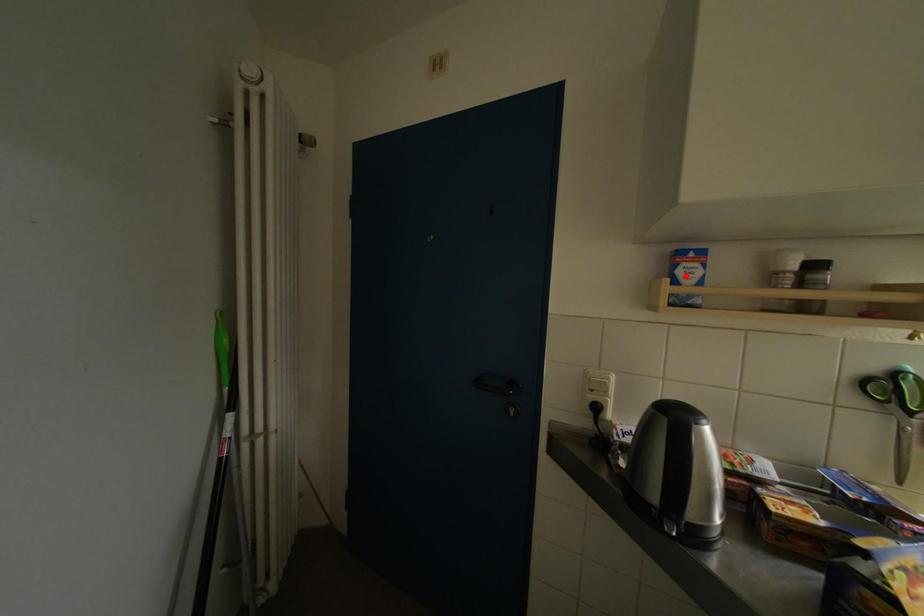
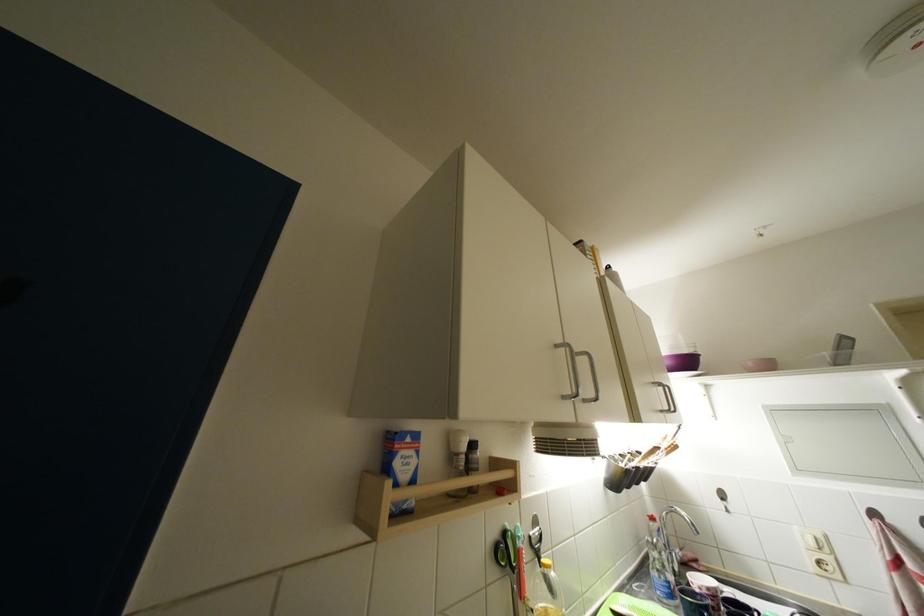
Locate, in the second image, the point that corresponds to the highlighted location in the first image.

(404, 467)